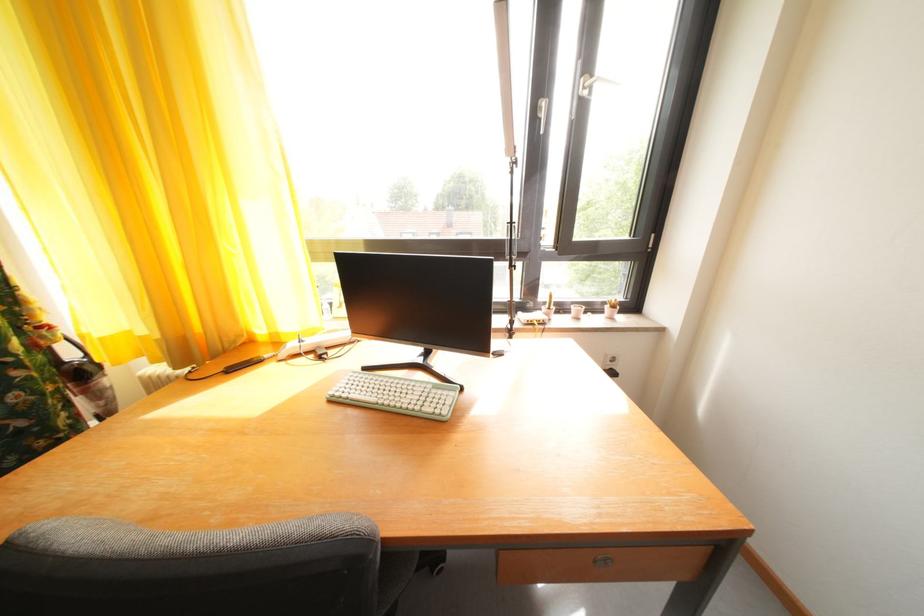
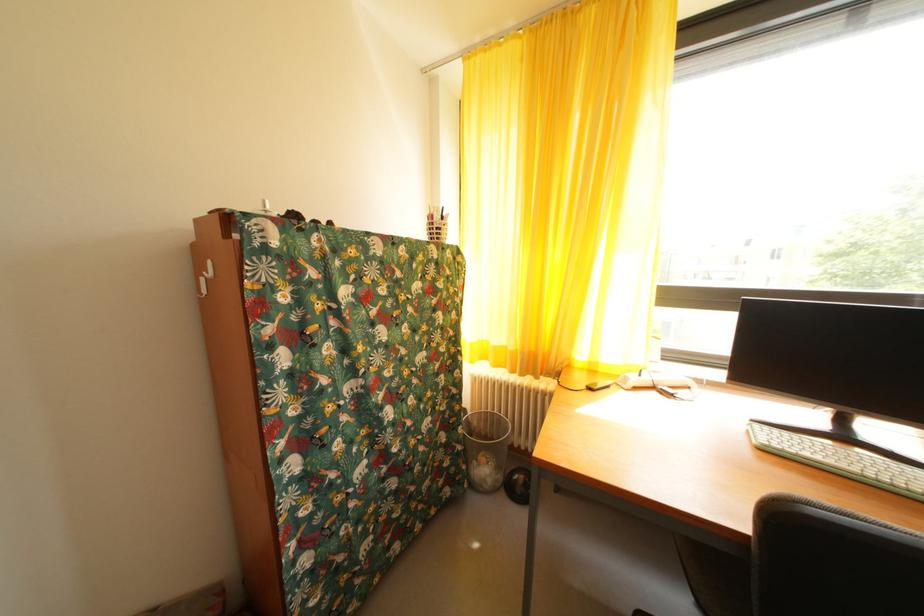
Locate, in the second image, the point that corresponds to (x=382, y=405) in the first image.

(854, 472)